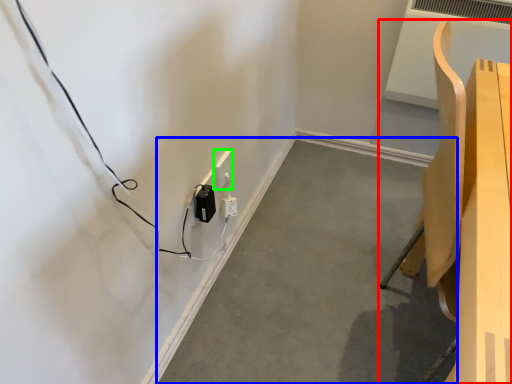
Question: Which is farther away from furniture (highlighted by a red box)? concrete (highlighted by a blue box) or electric outlet (highlighted by a green box)?

Choices:
 (A) concrete
 (B) electric outlet

Answer: (B)